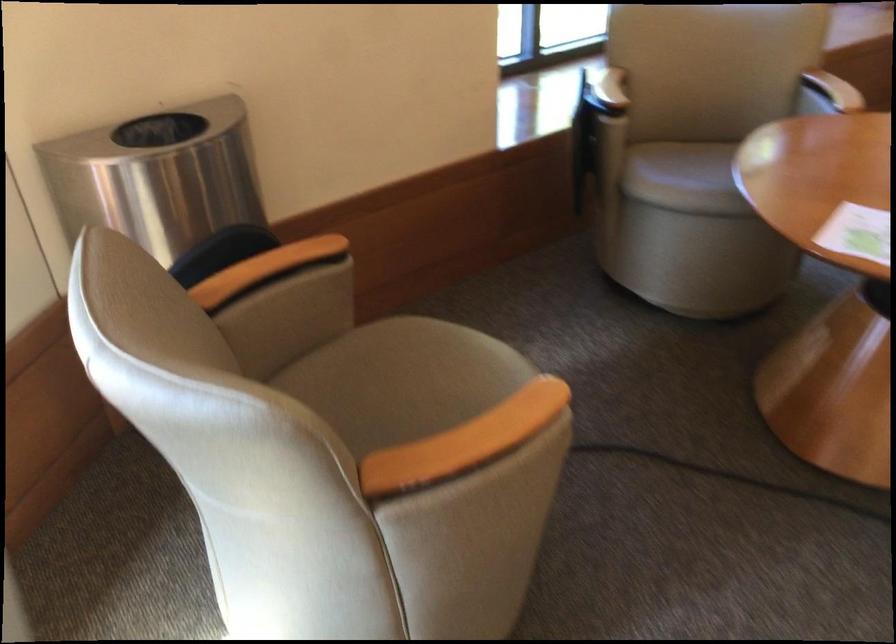
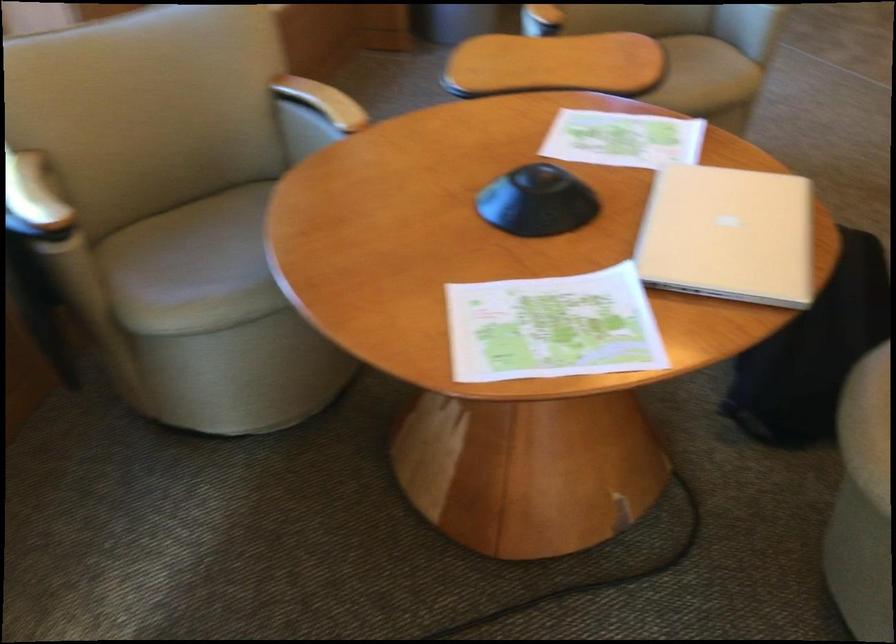
The point at (617, 82) is marked in the first image. Where is the corresponding point in the second image?

(33, 200)